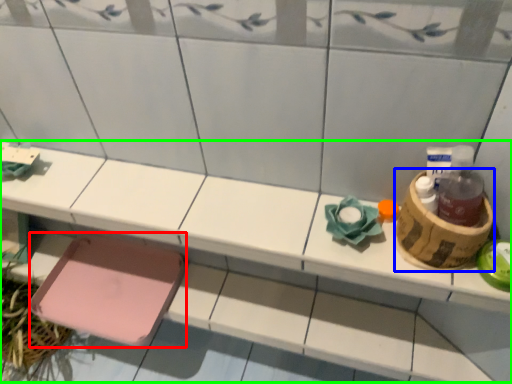
Question: Which object is the closest to the step stool (highlighted by a red box)? Choose among these: basket (highlighted by a blue box) or vanity (highlighted by a green box).

Choices:
 (A) basket
 (B) vanity

Answer: (B)